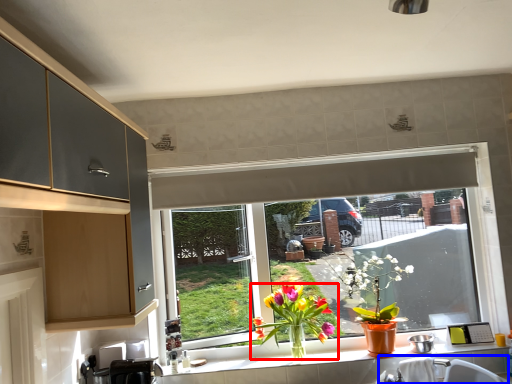
Question: Among these objects, which one is nearest to the camera, houseplant (highlighted by a red box) or sink (highlighted by a blue box)?

Choices:
 (A) houseplant
 (B) sink

Answer: (B)